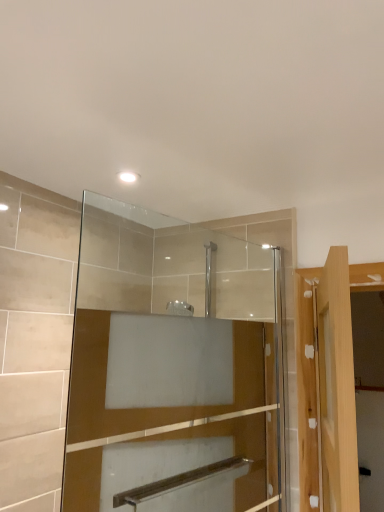
Question: From the image's perspective, is light wood door at right located above transparent glass mirror at upper center?

Choices:
 (A) no
 (B) yes

Answer: (A)

Question: Considering the relative positions of light wood door at right and transparent glass mirror at upper center in the image provided, is light wood door at right to the left of transparent glass mirror at upper center from the viewer's perspective?

Choices:
 (A) no
 (B) yes

Answer: (A)

Question: Considering the relative sizes of light wood door at right and transparent glass mirror at upper center in the image provided, is light wood door at right thinner than transparent glass mirror at upper center?

Choices:
 (A) yes
 (B) no

Answer: (B)

Question: Considering the relative positions of light wood door at right and transparent glass mirror at upper center in the image provided, is light wood door at right to the right of transparent glass mirror at upper center from the viewer's perspective?

Choices:
 (A) yes
 (B) no

Answer: (A)

Question: Is light wood door at right not near transparent glass mirror at upper center?

Choices:
 (A) yes
 (B) no

Answer: (B)

Question: From the image's perspective, is light wood door at right below transparent glass mirror at upper center?

Choices:
 (A) no
 (B) yes

Answer: (B)

Question: Is transparent glass mirror at upper center with light wood door at right?

Choices:
 (A) yes
 (B) no

Answer: (B)

Question: Does transparent glass mirror at upper center have a lesser height compared to light wood door at right?

Choices:
 (A) no
 (B) yes

Answer: (A)

Question: From a real-world perspective, is transparent glass mirror at upper center on top of light wood door at right?

Choices:
 (A) yes
 (B) no

Answer: (A)

Question: From a real-world perspective, is transparent glass mirror at upper center physically below light wood door at right?

Choices:
 (A) no
 (B) yes

Answer: (A)

Question: Can light wood door at right be found inside transparent glass mirror at upper center?

Choices:
 (A) no
 (B) yes

Answer: (A)

Question: Considering the relative positions of transparent glass mirror at upper center and light wood door at right in the image provided, is transparent glass mirror at upper center in front of light wood door at right?

Choices:
 (A) no
 (B) yes

Answer: (A)

Question: Looking at the image, does transparent glass mirror at upper center seem bigger or smaller compared to light wood door at right?

Choices:
 (A) small
 (B) big

Answer: (A)